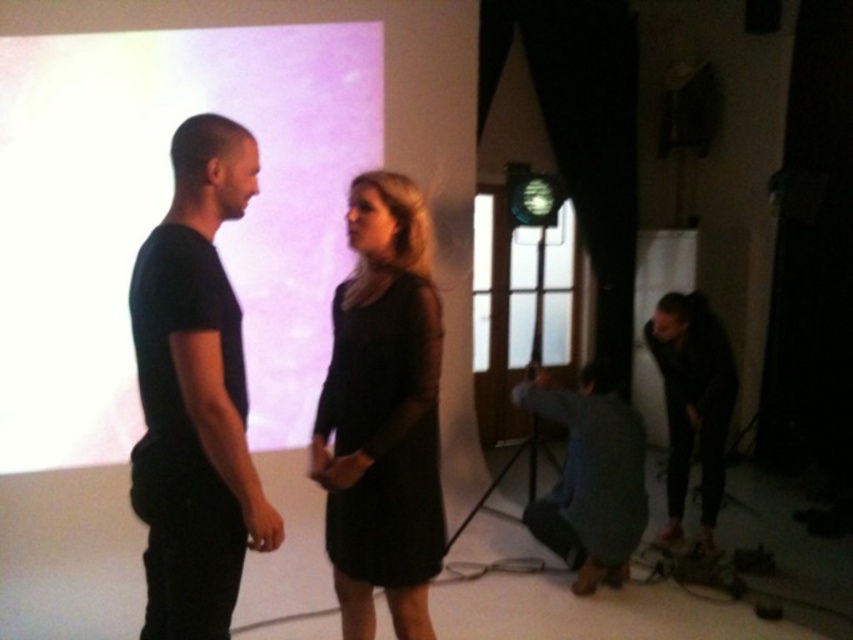
Question: Estimate the real-world distances between objects in this image. Which object is farther from the black matte dress at center?

Choices:
 (A) blue denim jeans at lower right
 (B) black matte t-shirt at left
 (C) black matte dress at lower right
 (D) white matte projection screen at upper left

Answer: (C)

Question: Is black matte dress at center closer to the viewer compared to black matte dress at lower right?

Choices:
 (A) yes
 (B) no

Answer: (A)

Question: Among these points, which one is farthest from the camera?

Choices:
 (A) (595, 456)
 (B) (705, 548)

Answer: (B)

Question: Is black matte t-shirt at left positioned before black matte dress at center?

Choices:
 (A) no
 (B) yes

Answer: (B)

Question: Is white matte projection screen at upper left above black matte dress at lower right?

Choices:
 (A) no
 (B) yes

Answer: (B)

Question: Which of the following is the closest to the observer?

Choices:
 (A) black matte dress at lower right
 (B) black matte dress at center

Answer: (B)